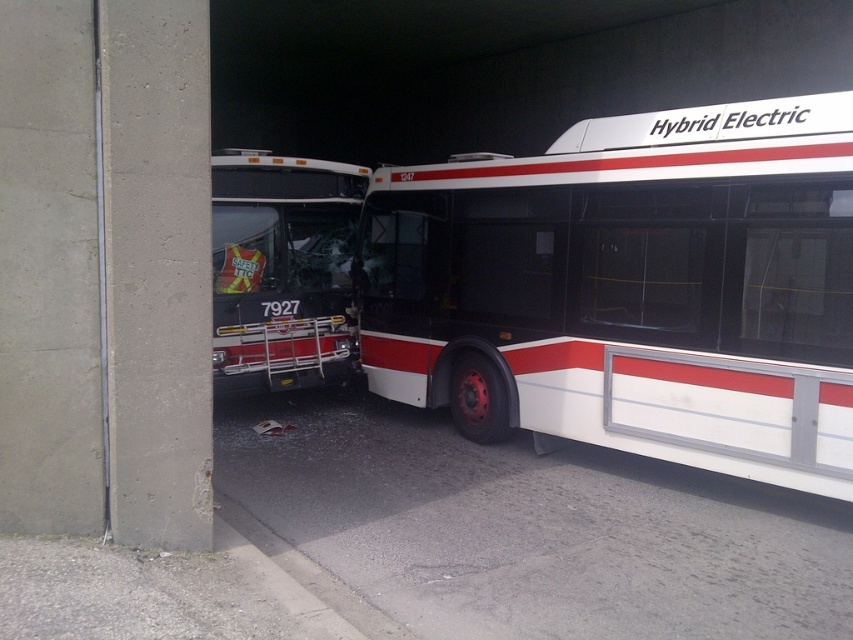
Can you confirm if white glossy hybrid electric bus at center is taller than matte black bus at left?

Indeed, white glossy hybrid electric bus at center has a greater height compared to matte black bus at left.

Who is taller, white glossy hybrid electric bus at center or matte black bus at left?

white glossy hybrid electric bus at center

Is point (419, 195) positioned in front of point (229, 243)?

Yes, point (419, 195) is in front of point (229, 243).

Where is `white glossy hybrid electric bus at center`? This screenshot has height=640, width=853. white glossy hybrid electric bus at center is located at coordinates (631, 289).